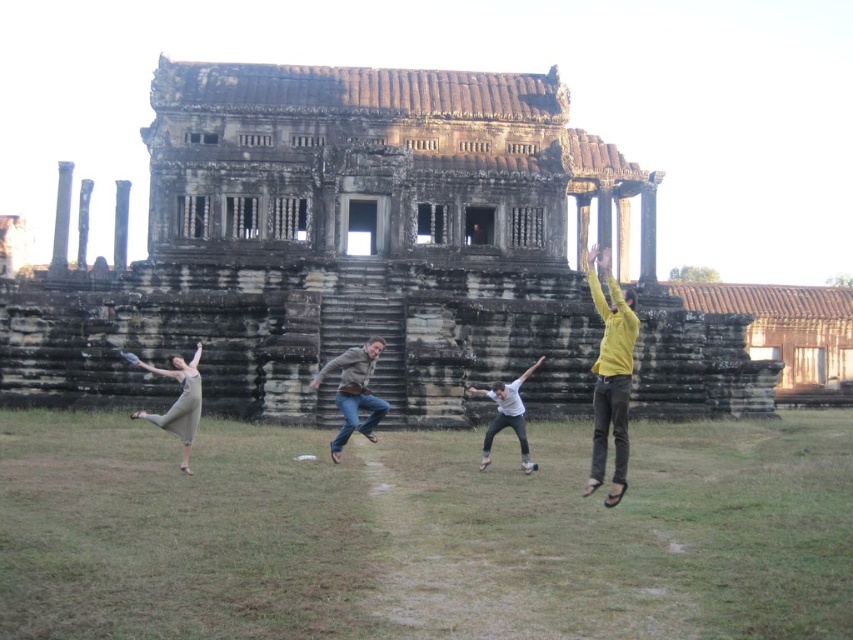
You are planning to take a photo of the weathered stone temple at center and the yellow matte shirt at right. To ensure both are fully visible in the frame, which object should be closer to the camera?

The yellow matte shirt at right should be closer to the camera because the weathered stone temple at center might be wider than it, so positioning the shirt closer helps fit both into the frame.

Looking at this image, you are a photographer standing in front of the ancient temple. You notice the white matte shirt at center and the white plastic frisbee at center in the scene. Which object is closer to the ground?

The white matte shirt at center is located below the white plastic frisbee at center, so the white matte shirt at center is closer to the ground.

You are a photographer trying to capture the weathered stone temple at center and the yellow matte shirt at right in the same frame. Which object should you focus on first if you want to ensure both are in focus?

The weathered stone temple at center is larger in size than the yellow matte shirt at right, so you should focus on the weathered stone temple at center first to ensure both are in focus.